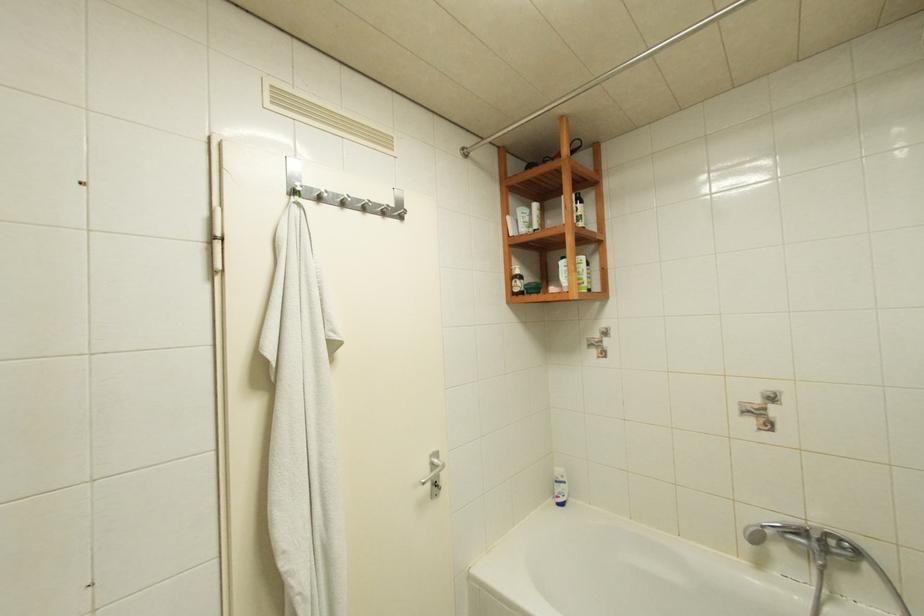
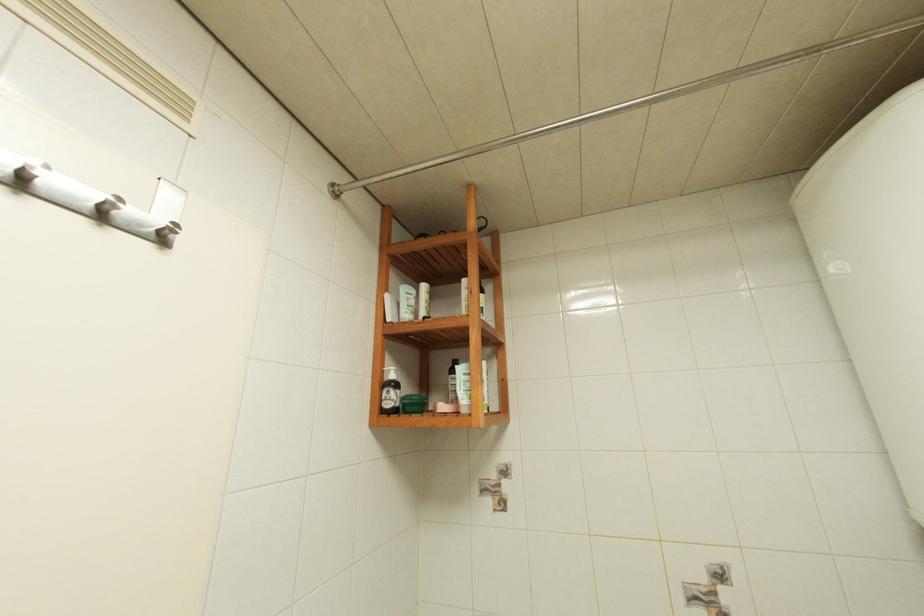
Based on the continuous images, in which direction is the camera rotating?

The camera's rotation is toward right-up.